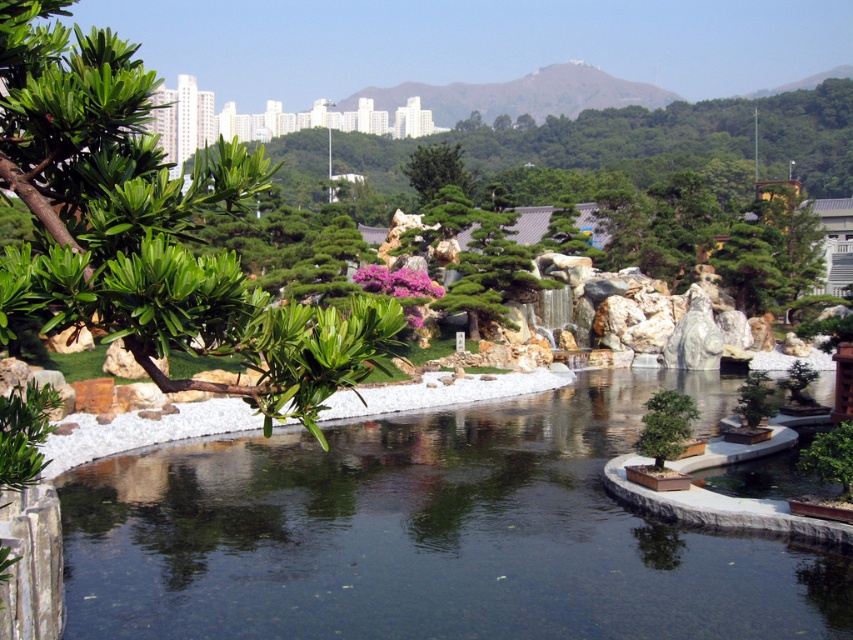
Between point (712, 577) and point (405, 168), which one is positioned in front?

Point (712, 577) is in front.

Between clear water at center and green textured tree at center, which one has more height?

With more height is green textured tree at center.

Which is in front, point (722, 401) or point (442, 144)?

Point (722, 401) is more forward.

At what (x,y) coordinates should I click in order to perform the action: click on clear water at center. Please return your answer as a coordinate pair (x, y). Looking at the image, I should click on (427, 532).

Where is `green leafy branch at left`? Image resolution: width=853 pixels, height=640 pixels. green leafy branch at left is located at coordinates (149, 228).

From the picture: Is green leafy branch at left shorter than green textured tree at center?

Yes, green leafy branch at left is shorter than green textured tree at center.

Which is in front, point (54, 172) or point (439, 182)?

Positioned in front is point (54, 172).

Image resolution: width=853 pixels, height=640 pixels. Find the location of `green leafy branch at left`. green leafy branch at left is located at coordinates (149, 228).

Does clear water at center have a lesser width compared to green leafy branch at left?

No, clear water at center is not thinner than green leafy branch at left.

Which of these two, clear water at center or green leafy branch at left, stands taller?

green leafy branch at left is taller.

Where is `clear water at center`? clear water at center is located at coordinates (427, 532).